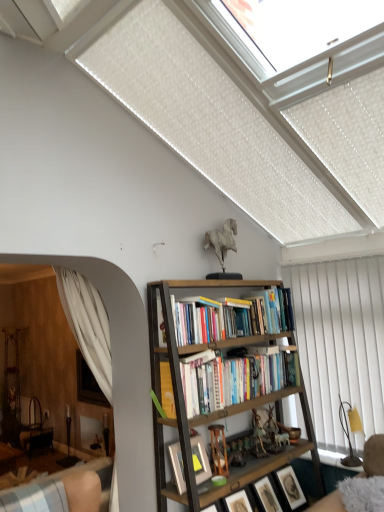
Question: From the image's perspective, is white matte horse at upper center, acting as the 1th toy starting from the left, located above matte black picture frame at center, which is counted as the first picture frame, starting from the left?

Choices:
 (A) yes
 (B) no

Answer: (A)

Question: Does white matte horse at upper center, acting as the first toy starting from the top, lie behind matte black picture frame at center, which ranks as the 3th picture frame in right-to-left order?

Choices:
 (A) yes
 (B) no

Answer: (A)

Question: Is white matte horse at upper center, the second toy from the bottom, oriented away from matte black picture frame at center, which ranks as the 3th picture frame in right-to-left order?

Choices:
 (A) no
 (B) yes

Answer: (A)

Question: Considering the relative positions of white matte horse at upper center, acting as the first toy starting from the top, and matte black picture frame at center, which ranks as the 3th picture frame in right-to-left order, in the image provided, is white matte horse at upper center, acting as the first toy starting from the top, to the left of matte black picture frame at center, which ranks as the 3th picture frame in right-to-left order, from the viewer's perspective?

Choices:
 (A) no
 (B) yes

Answer: (A)

Question: Does white matte horse at upper center, acting as the 1th toy starting from the left, have a lesser width compared to matte black picture frame at center, which ranks as the 3th picture frame in right-to-left order?

Choices:
 (A) yes
 (B) no

Answer: (B)

Question: From the image's perspective, is wooden bookcase at center above or below white matte horse at upper center, the second toy from the bottom?

Choices:
 (A) above
 (B) below

Answer: (B)

Question: Is wooden bookcase at center taller or shorter than white matte horse at upper center, positioned as the 2th toy in right-to-left order?

Choices:
 (A) short
 (B) tall

Answer: (B)

Question: Considering their positions, is wooden bookcase at center located in front of or behind white matte horse at upper center, the second toy from the bottom?

Choices:
 (A) behind
 (B) front

Answer: (B)

Question: Choose the correct answer: Is wooden bookcase at center inside white matte horse at upper center, acting as the first toy starting from the top, or outside it?

Choices:
 (A) inside
 (B) outside

Answer: (B)

Question: From a real-world perspective, is wooden picture frame at lower center, the 2th picture frame from the right, physically located above or below matte black picture frame at center, which ranks as the 3th picture frame in right-to-left order?

Choices:
 (A) below
 (B) above

Answer: (A)

Question: Does point (276, 503) appear closer or farther from the camera than point (185, 488)?

Choices:
 (A) farther
 (B) closer

Answer: (A)

Question: From the image's perspective, relative to matte black picture frame at center, which is counted as the first picture frame, starting from the left, is wooden picture frame at lower center, which is the 2th picture frame from left to right, above or below?

Choices:
 (A) above
 (B) below

Answer: (B)

Question: From their relative heights in the image, would you say wooden picture frame at lower center, the 2th picture frame from the right, is taller or shorter than matte black picture frame at center, which is counted as the first picture frame, starting from the left?

Choices:
 (A) short
 (B) tall

Answer: (B)

Question: Considering the positions of white vertical blinds at right and matte black picture frame at center, which ranks as the 3th picture frame in right-to-left order, in the image, is white vertical blinds at right wider or thinner than matte black picture frame at center, which ranks as the 3th picture frame in right-to-left order,?

Choices:
 (A) wide
 (B) thin

Answer: (B)

Question: Based on their positions, is white vertical blinds at right located to the left or right of matte black picture frame at center, which is counted as the first picture frame, starting from the left?

Choices:
 (A) right
 (B) left

Answer: (A)